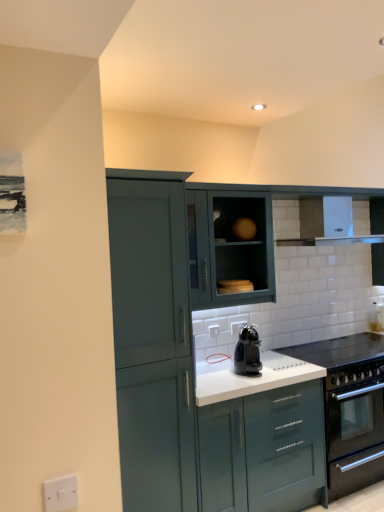
Where is `free spot below black plastic coffee machine at center (from a real-world perspective)`? This screenshot has width=384, height=512. free spot below black plastic coffee machine at center (from a real-world perspective) is located at coordinates (265, 373).